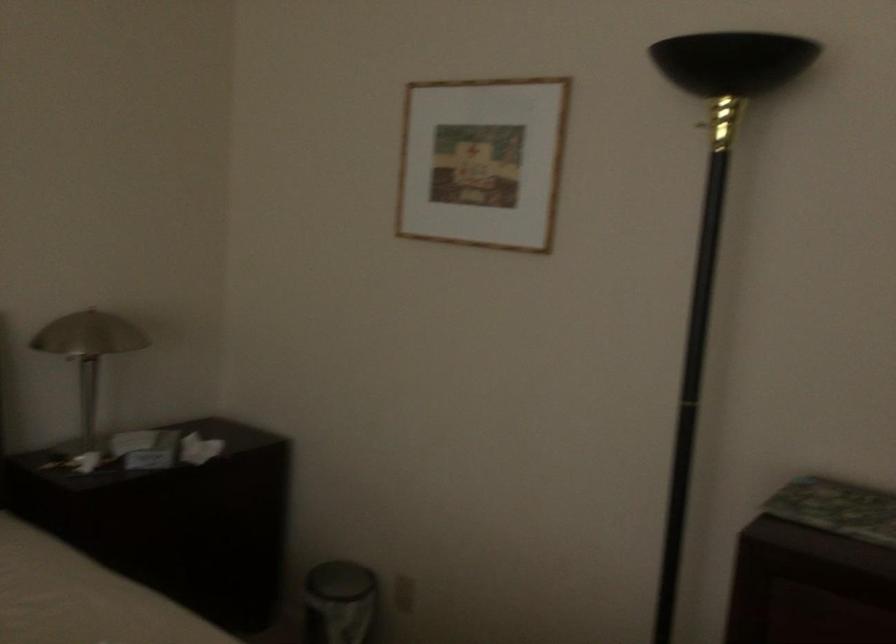
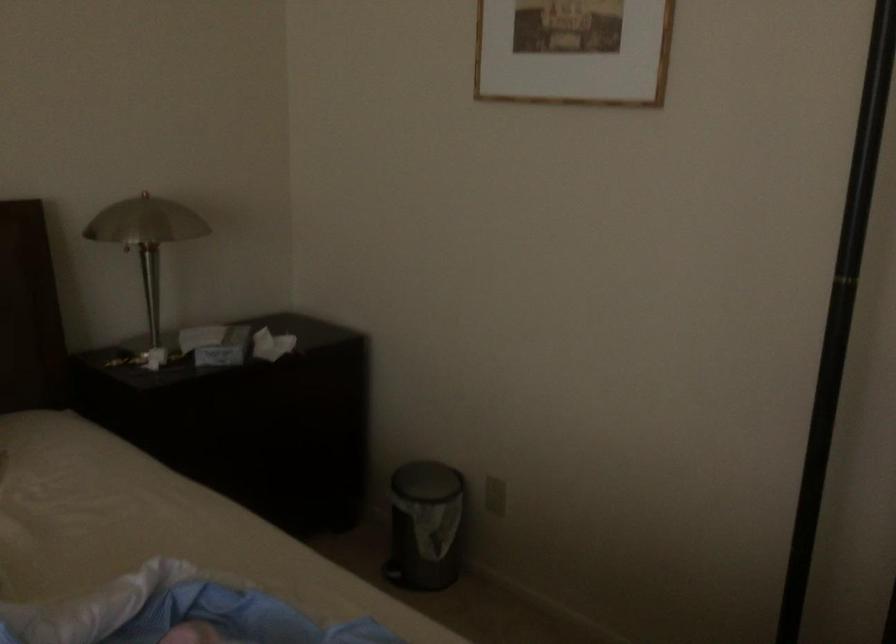
The point at (149, 449) is marked in the first image. Where is the corresponding point in the second image?

(216, 344)